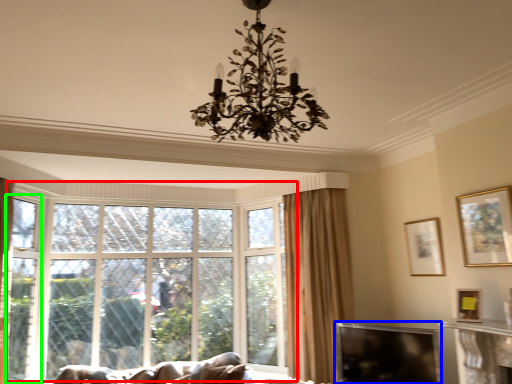
Question: Estimate the real-world distances between objects in this image. Which object is closer to window (highlighted by a red box), window screen (highlighted by a blue box) or screen door (highlighted by a green box)?

Choices:
 (A) window screen
 (B) screen door

Answer: (B)